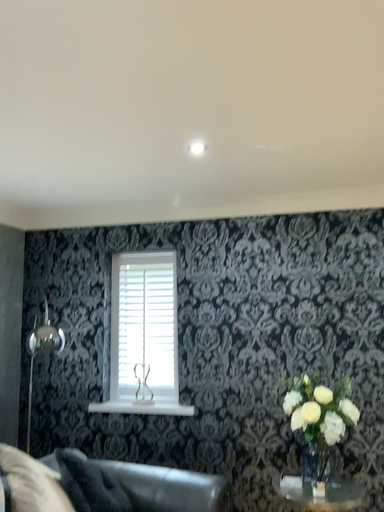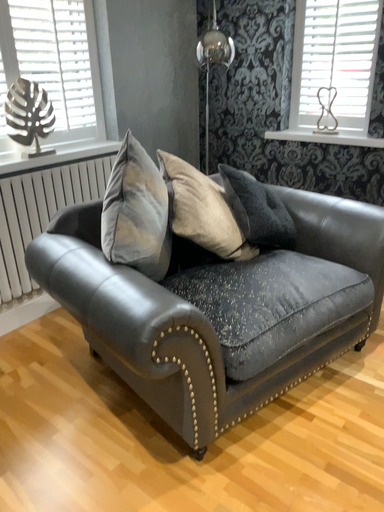
Question: Which way did the camera rotate in the video?

Choices:
 (A) rotated right
 (B) rotated left

Answer: (B)